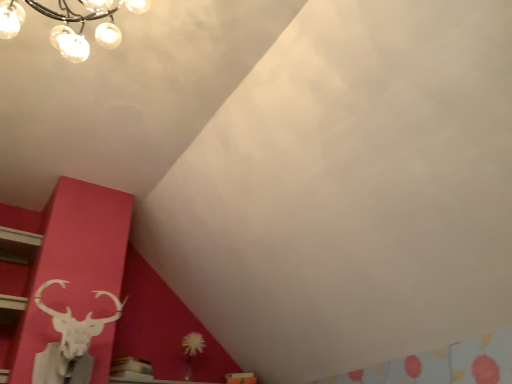
Question: Should I look upward or downward to see matte glass chandelier at upper left?

Choices:
 (A) up
 (B) down

Answer: (A)